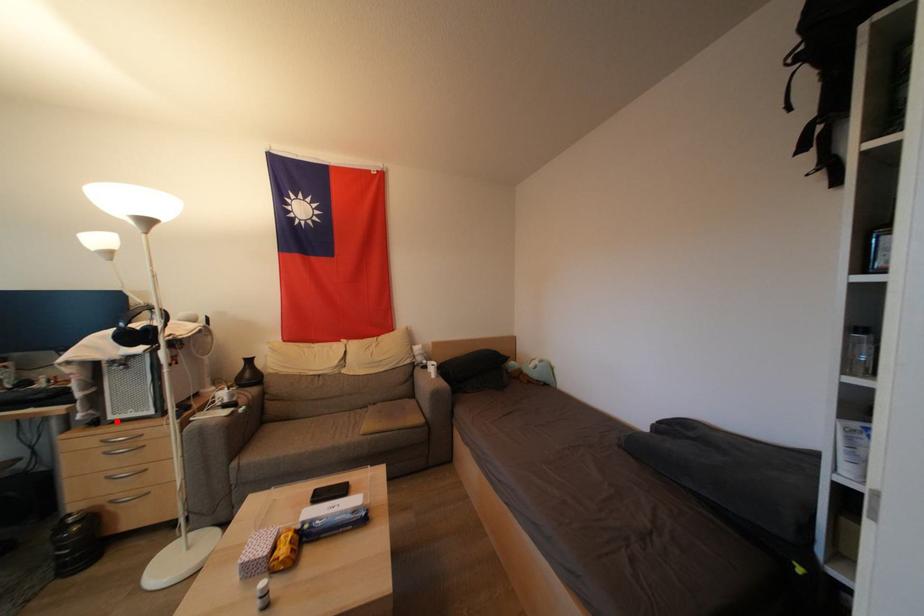
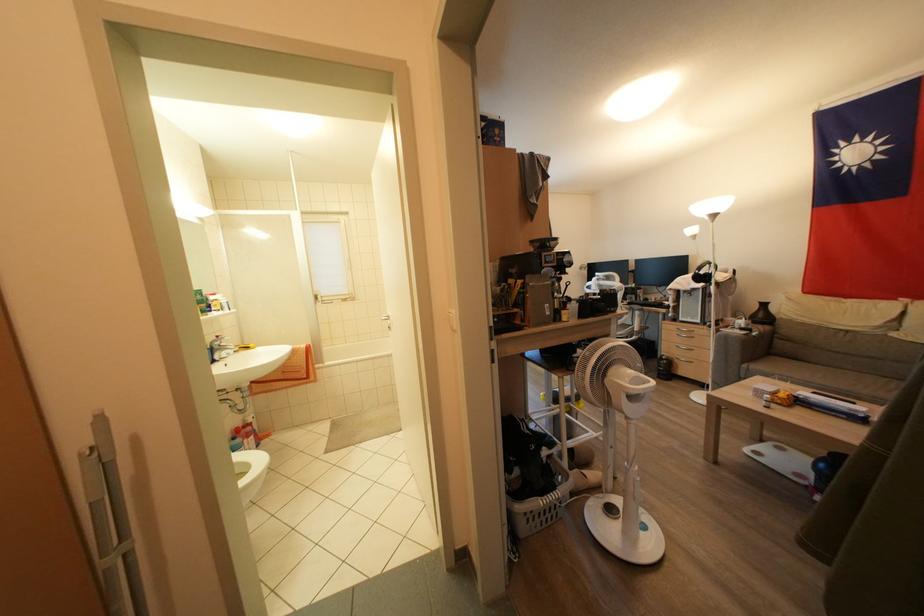
The point at the highlighted location is marked in the first image. Where is the corresponding point in the second image?

(686, 323)